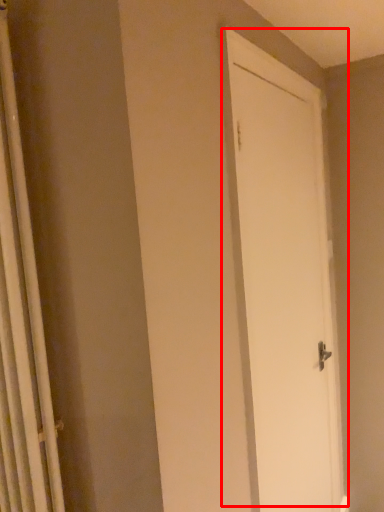
Question: From the image's perspective, what is the correct spatial positioning of door (annotated by the red box) in reference to shower curtain?

Choices:
 (A) above
 (B) below

Answer: (B)